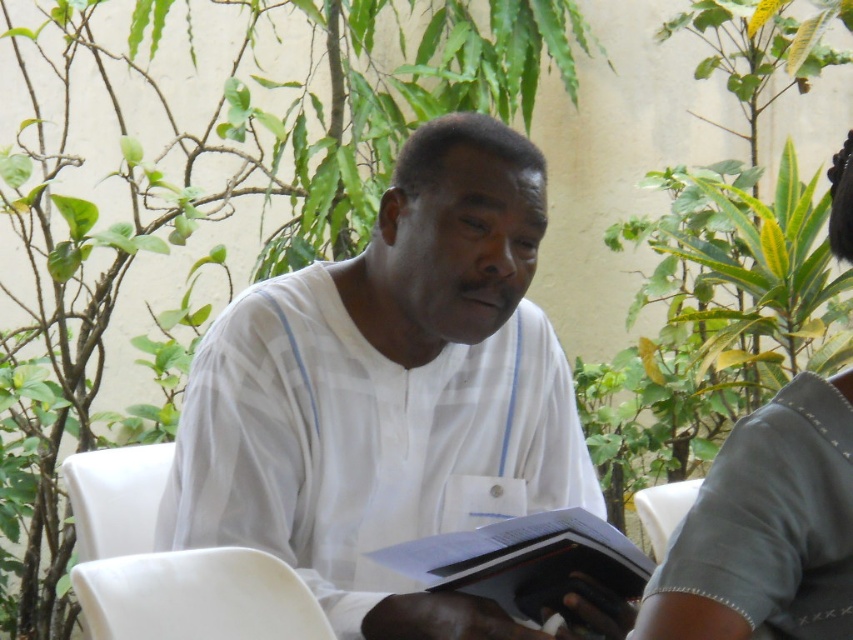
Based on the photo, you are standing in the garden and want to sit down on one of the chairs. Which chair is closer to you, the white smooth chair at lower left or the white plastic chair at left?

The white smooth chair at lower left is closer to you than the white plastic chair at left.

You are planning to place a small table between the white smooth chair at lower left and the white plastic chair at left. Which chair should the table be closer to if you want to ensure it is equidistant from both chairs?

The table should be placed closer to the white plastic chair at left because the white smooth chair at lower left might be wider, requiring more space between them to maintain equal distance.

You are a photographer standing at the camera position. You want to take a photo of the man reading the hardcover book at center. The camera has a focal length of 50mm. According to the rule of thirds, should you move closer or farther away to frame the book properly?

The camera is 2.24 meters away from the hardcover book at center. To follow the rule of thirds, you should move closer to the book so that it aligns with the intersection points of the grid, ensuring a balanced composition.